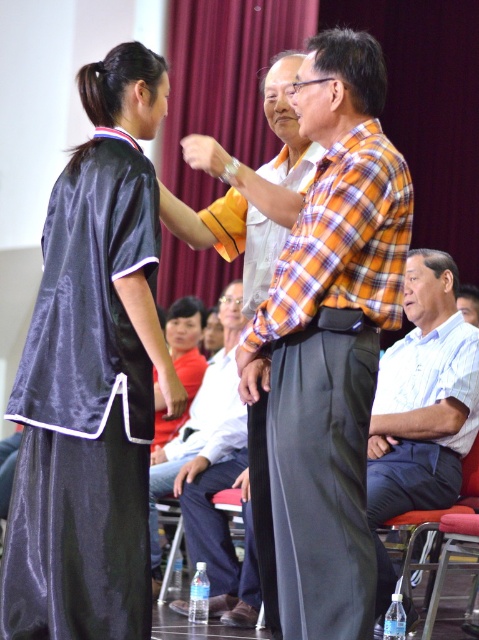
Can you confirm if silky black robe at center is positioned below white cotton shirt at center?

No, silky black robe at center is not below white cotton shirt at center.

The width and height of the screenshot is (479, 640). I want to click on silky black robe at center, so click(x=328, y=385).

Is point (376, 257) more distant than point (180, 467)?

No, it is not.

Image resolution: width=479 pixels, height=640 pixels. I want to click on silky black robe at center, so click(328, 385).

Image resolution: width=479 pixels, height=640 pixels. Find the location of `satin black robe at left`. satin black robe at left is located at coordinates point(83,410).

Who is more distant from viewer, (125, 314) or (386, 452)?

The point (386, 452) is behind.

Is point (45, 531) positioned in front of point (447, 392)?

Yes, point (45, 531) is in front of point (447, 392).

At what (x,y) coordinates should I click in order to perform the action: click on satin black robe at left. Please return your answer as a coordinate pair (x, y). The image size is (479, 640). Looking at the image, I should click on (83, 410).

Between point (75, 182) and point (175, 481), which one is positioned in front?

Point (75, 182)

What do you see at coordinates (83, 410) in the screenshot? This screenshot has width=479, height=640. I see `satin black robe at left` at bounding box center [83, 410].

At what (x,y) coordinates should I click in order to perform the action: click on satin black robe at left. Please return your answer as a coordinate pair (x, y). Image resolution: width=479 pixels, height=640 pixels. Looking at the image, I should click on (83, 410).